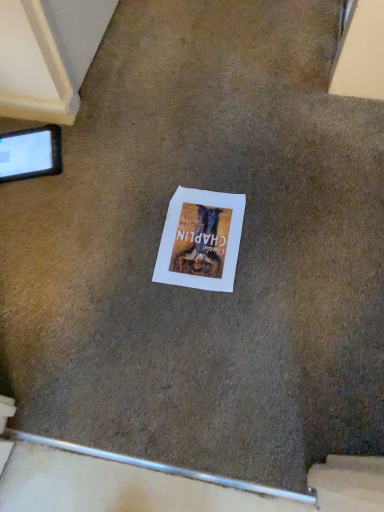
You are a GUI agent. You are given a task and a screenshot of the screen. Output one action in this format:
    pyautogui.click(x=<x>, y=<y>)
    Task: Click on the free location in front of white paper at center
    The width and height of the screenshot is (384, 512).
    Given the screenshot: What is the action you would take?
    pyautogui.click(x=203, y=327)